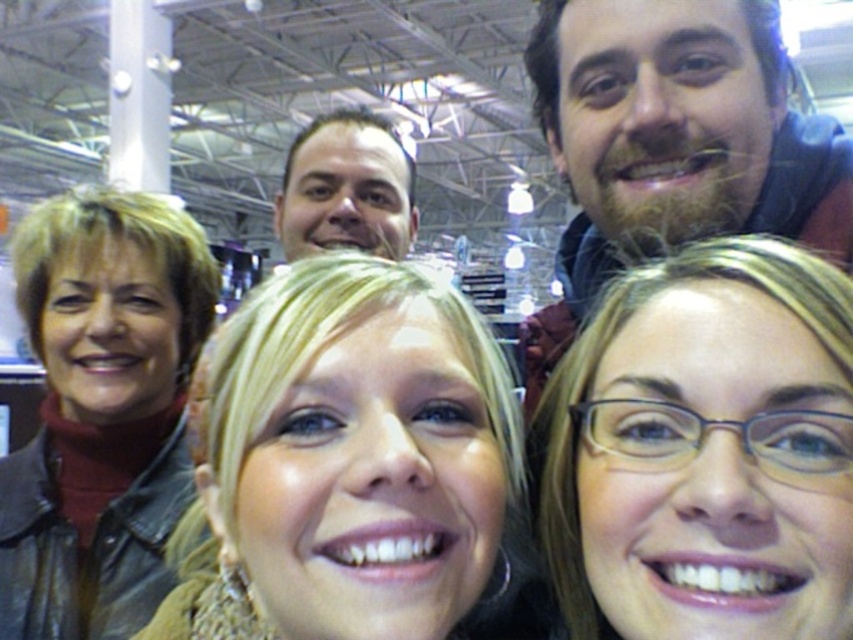
Question: Is matte brown hair at lower right in front of smooth brown hair at center?

Choices:
 (A) yes
 (B) no

Answer: (A)

Question: Which of the following is the farthest from the observer?

Choices:
 (A) brown leather jacket at left
 (B) blonde hair at center

Answer: (A)

Question: From the image, what is the correct spatial relationship of matte brown hair at lower right in relation to bearded man at upper right?

Choices:
 (A) left
 (B) right

Answer: (A)

Question: Considering the real-world distances, which object is closest to the bearded man at upper right?

Choices:
 (A) matte brown hair at lower right
 (B) smooth brown hair at center
 (C) blonde hair at center

Answer: (A)

Question: Can you confirm if blonde hair at center is smaller than brown leather jacket at left?

Choices:
 (A) yes
 (B) no

Answer: (B)

Question: Among these objects, which one is nearest to the camera?

Choices:
 (A) brown leather jacket at left
 (B) bearded man at upper right
 (C) smooth brown hair at center

Answer: (B)